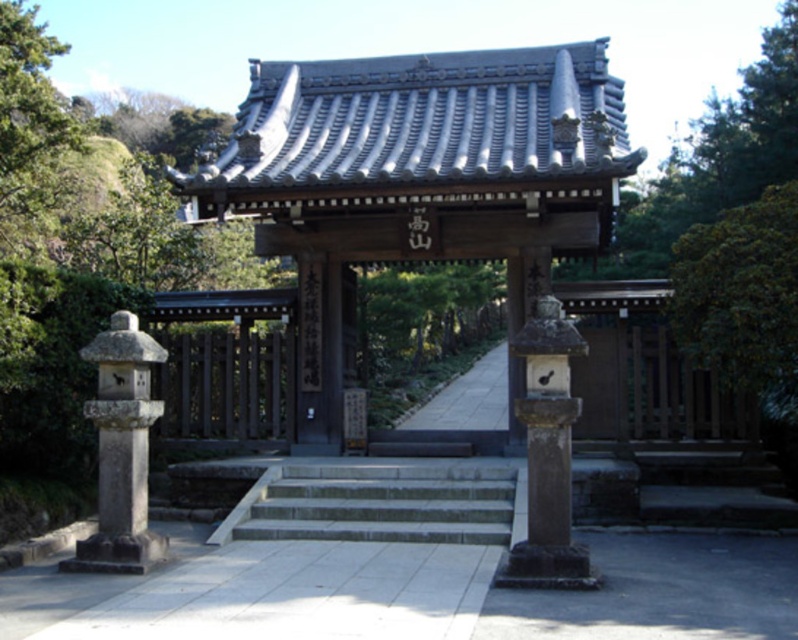
Who is higher up, smooth gray stone gate at center or smooth stone lantern at center?

smooth gray stone gate at center is above.

Can you confirm if smooth gray stone gate at center is shorter than smooth stone lantern at center?

Incorrect, smooth gray stone gate at center's height does not fall short of smooth stone lantern at center's.

Does point (433, 188) come farther from viewer compared to point (548, 545)?

Yes, point (433, 188) is farther from viewer.

What are the coordinates of `smooth gray stone gate at center` in the screenshot? It's located at (417, 179).

Does smooth gray stone gate at center appear over gray stone stairs at center?

Correct, smooth gray stone gate at center is located above gray stone stairs at center.

Between point (259, 129) and point (377, 522), which one is positioned behind?

The point (259, 129) is behind.

Find the location of `smooth gray stone gate at center`. smooth gray stone gate at center is located at coordinates (417, 179).

Can you confirm if gray stone stairs at center is taller than gray stone lantern at left?

Incorrect, gray stone stairs at center's height is not larger of gray stone lantern at left's.

Based on the photo, who is more distant from viewer, (311, 531) or (125, 316)?

The point (311, 531) is behind.

This screenshot has width=798, height=640. In order to click on gray stone stairs at center in this screenshot , I will do `click(374, 504)`.

At what (x,y) coordinates should I click in order to perform the action: click on gray stone stairs at center. Please return your answer as a coordinate pair (x, y). Looking at the image, I should click on (374, 504).